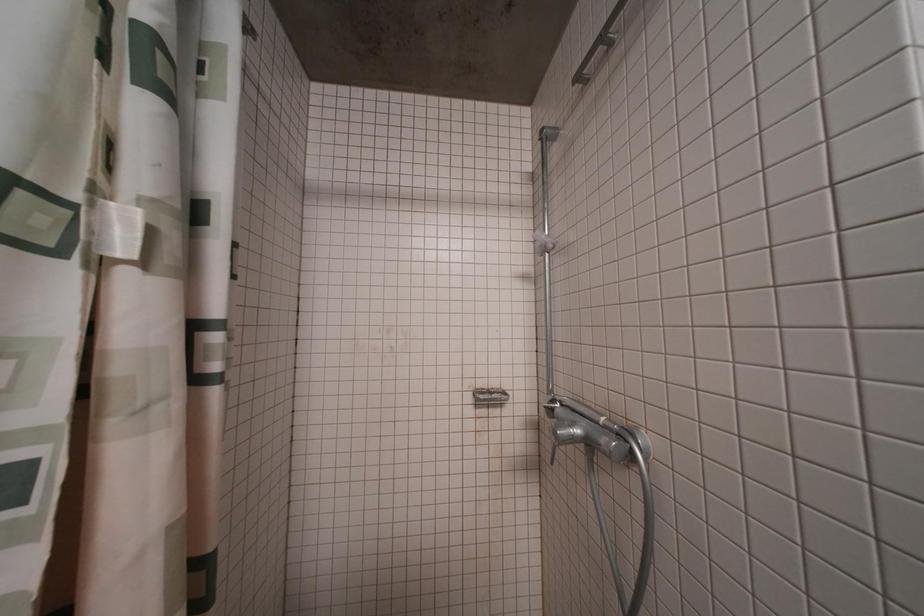
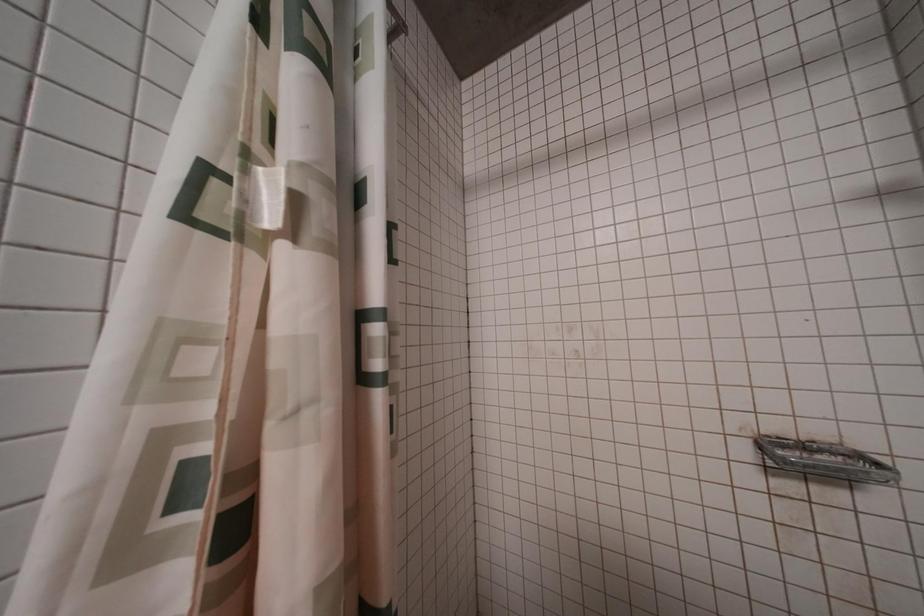
Question: The images are taken continuously from a first-person perspective. In which direction is your viewpoint rotating?

Choices:
 (A) Left
 (B) Right
 (C) Up
 (D) Down

Answer: (A)